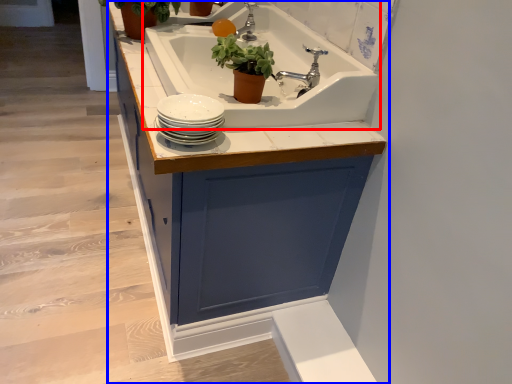
Question: Which point is further to the camera, sink (highlighted by a red box) or cabinetry (highlighted by a blue box)?

Choices:
 (A) sink
 (B) cabinetry

Answer: (A)